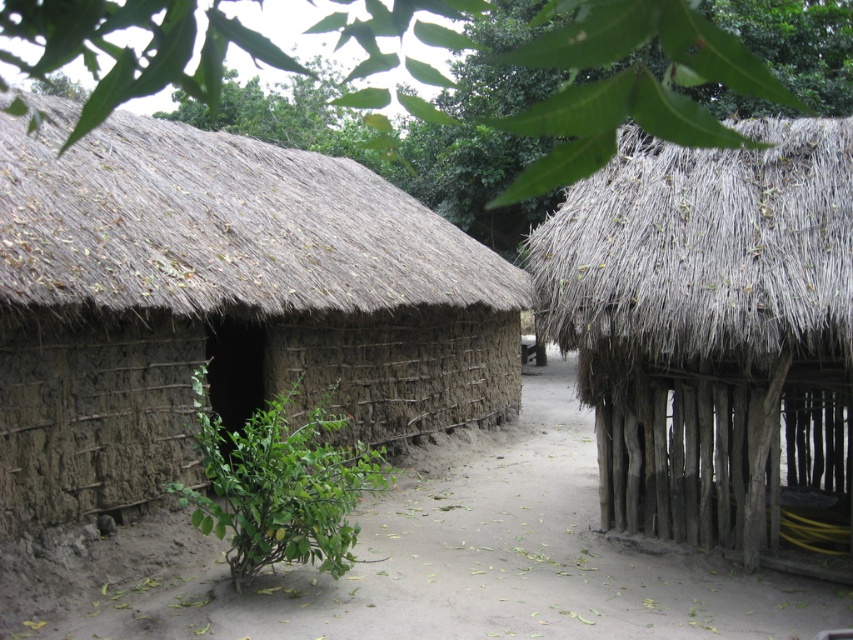
Who is positioned more to the left, thatched straw hut at center or brown thatch roof at left?

Positioned to the left is brown thatch roof at left.

Does point (722, 188) lie behind point (375, 305)?

No.

Locate an element on the screen. thatched straw hut at center is located at coordinates (711, 330).